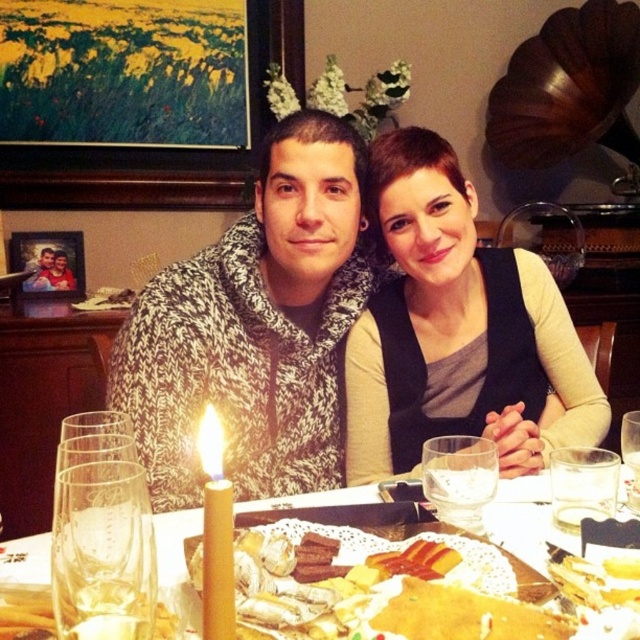
You are a server at a restaurant and need to place a dessert plate between the translucent glass plate at center and the transparent glass at table center. According to the scene description, where should you place the dessert plate?

The translucent glass plate at center is positioned on the left side of transparent glass at table center. Therefore, the dessert plate should be placed between them, to the right of the translucent glass plate at center and to the left of the transparent glass at table center.

You are a photographer standing at a distance of 40 centimeters from the dining table. You want to capture a closeup shot of the yellow beeswax candle at center without moving your position. Is it possible to focus on the candle clearly given your current distance?

The yellow beeswax candle at center is 41.31 centimeters away from the viewer. Since you are standing at 40 centimeters, you are slightly closer than the candle, making it difficult to focus on it clearly without adjusting your position or equipment.

You are a guest at this dinner table and want to place your napkin on the closest object to you between the translucent glass plate at center and the transparent glass at table center. Which object should you choose?

The translucent glass plate at center is closer to the viewer than the transparent glass at table center, so you should place your napkin on the translucent glass plate at center.